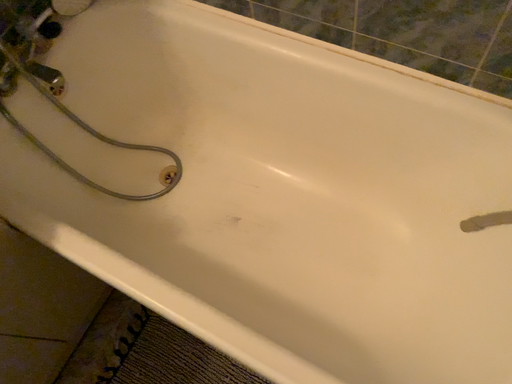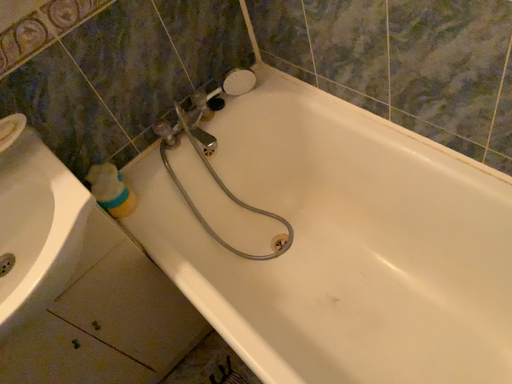
Question: How did the camera likely rotate when shooting the video?

Choices:
 (A) rotated upward
 (B) rotated downward

Answer: (A)